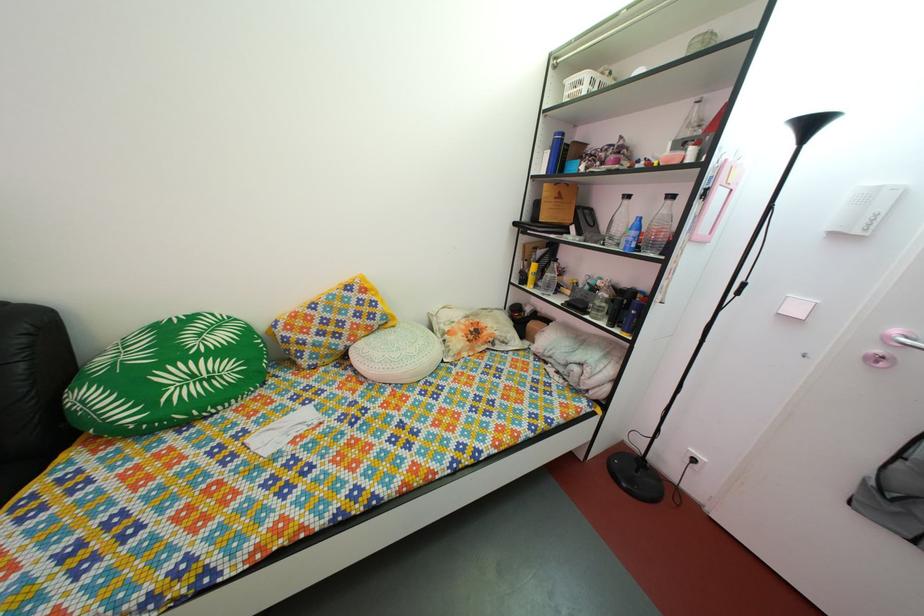
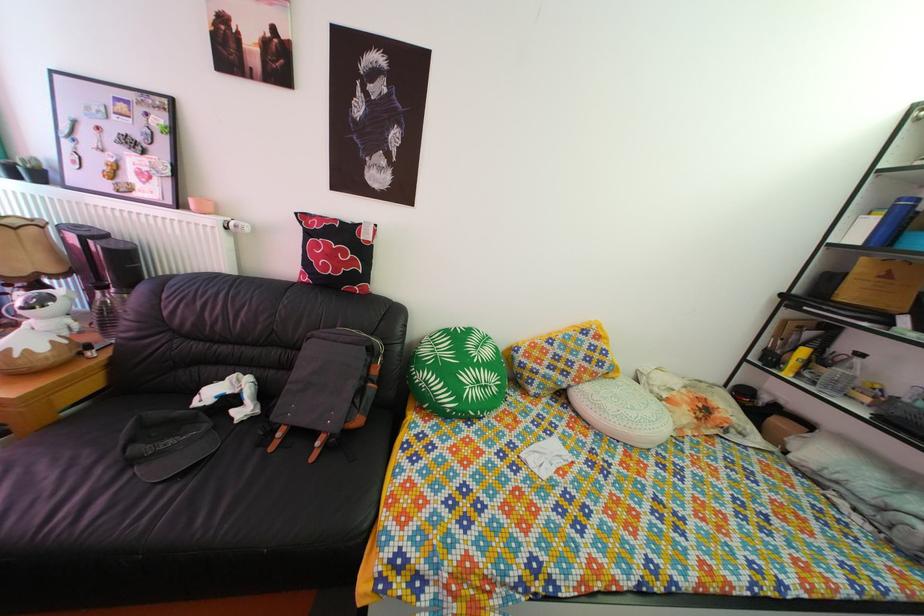
Where in the second image is the point corresponding to point 318,315 from the first image?

(555, 351)